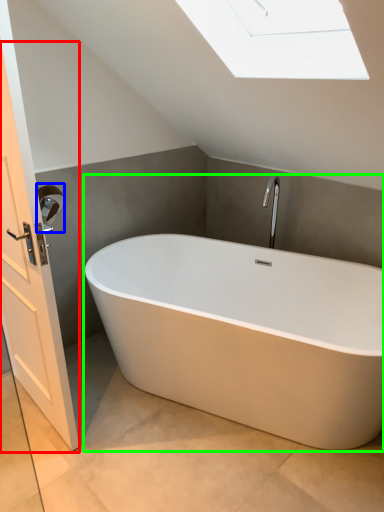
Question: Which is nearer to the screen door (highlighted by a red box)? towel bar (highlighted by a blue box) or bathtub (highlighted by a green box).

Choices:
 (A) towel bar
 (B) bathtub

Answer: (A)